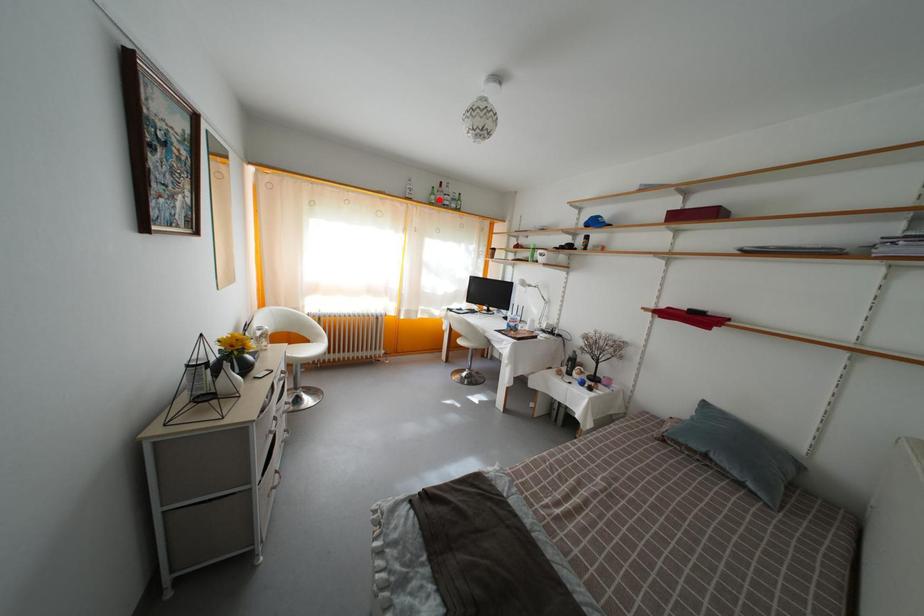
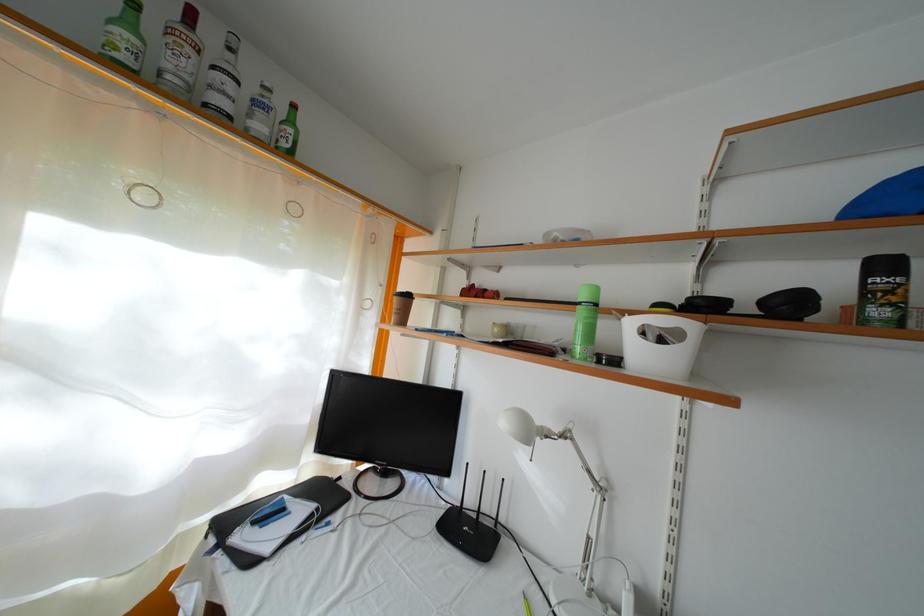
Question: A red point is marked in image1. In image2, is the corresponding 3D point closer to the camera or farther? Reply with the corresponding letter.

Choices:
 (A) The corresponding 3D point is closer.
 (B) The corresponding 3D point is farther.

Answer: (B)